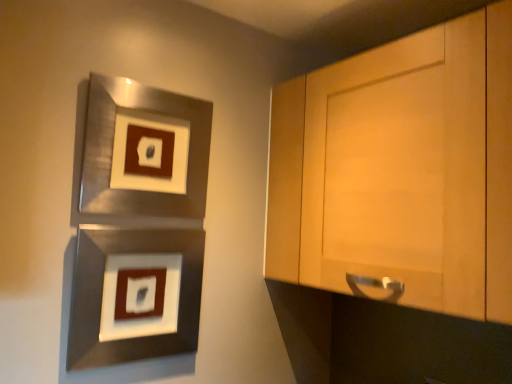
Image resolution: width=512 pixels, height=384 pixels. Describe the element at coordinates (134, 295) in the screenshot. I see `metallic silver picture frame at lower left, arranged as the second picture frame when viewed from the top` at that location.

Locate an element on the screen. This screenshot has width=512, height=384. metallic silver picture frame at lower left, arranged as the second picture frame when viewed from the top is located at coordinates (134, 295).

Image resolution: width=512 pixels, height=384 pixels. Identify the location of metallic silver picture frame at upper left, positioned as the first picture frame in top-to-bottom order. (144, 151).

The width and height of the screenshot is (512, 384). What do you see at coordinates (144, 151) in the screenshot?
I see `metallic silver picture frame at upper left, acting as the second picture frame starting from the bottom` at bounding box center [144, 151].

How much space does metallic silver picture frame at upper left, positioned as the first picture frame in top-to-bottom order, occupy vertically?

metallic silver picture frame at upper left, positioned as the first picture frame in top-to-bottom order, is 40.47 centimeters in height.

The height and width of the screenshot is (384, 512). In order to click on metallic silver picture frame at lower left, arranged as the second picture frame when viewed from the top in this screenshot , I will do `click(134, 295)`.

Between metallic silver picture frame at lower left, arranged as the second picture frame when viewed from the top, and metallic silver picture frame at upper left, acting as the second picture frame starting from the bottom, which one appears on the left side from the viewer's perspective?

From the viewer's perspective, metallic silver picture frame at lower left, arranged as the second picture frame when viewed from the top, appears more on the left side.

Considering their positions, is metallic silver picture frame at lower left, arranged as the 1th picture frame when ordered from the bottom, located in front of or behind metallic silver picture frame at upper left, acting as the second picture frame starting from the bottom?

Visually, metallic silver picture frame at lower left, arranged as the 1th picture frame when ordered from the bottom, is located in front of metallic silver picture frame at upper left, acting as the second picture frame starting from the bottom.

Does point (181, 320) come behind point (93, 187)?

That is True.

From the image's perspective, does metallic silver picture frame at lower left, arranged as the second picture frame when viewed from the top, appear lower than metallic silver picture frame at upper left, positioned as the first picture frame in top-to-bottom order?

Correct, metallic silver picture frame at lower left, arranged as the second picture frame when viewed from the top, appears lower than metallic silver picture frame at upper left, positioned as the first picture frame in top-to-bottom order, in the image.

From a real-world perspective, who is located higher, metallic silver picture frame at lower left, arranged as the 1th picture frame when ordered from the bottom, or metallic silver picture frame at upper left, acting as the second picture frame starting from the bottom?

metallic silver picture frame at upper left, acting as the second picture frame starting from the bottom, from a real-world perspective.

Can you confirm if metallic silver picture frame at lower left, arranged as the 1th picture frame when ordered from the bottom, is wider than metallic silver picture frame at upper left, acting as the second picture frame starting from the bottom?

Correct, the width of metallic silver picture frame at lower left, arranged as the 1th picture frame when ordered from the bottom, exceeds that of metallic silver picture frame at upper left, acting as the second picture frame starting from the bottom.

Which of these two, metallic silver picture frame at lower left, arranged as the second picture frame when viewed from the top, or metallic silver picture frame at upper left, positioned as the first picture frame in top-to-bottom order, stands taller?

Standing taller between the two is metallic silver picture frame at upper left, positioned as the first picture frame in top-to-bottom order.

Can you confirm if metallic silver picture frame at lower left, arranged as the second picture frame when viewed from the top, is bigger than metallic silver picture frame at upper left, positioned as the first picture frame in top-to-bottom order?

Incorrect, metallic silver picture frame at lower left, arranged as the second picture frame when viewed from the top, is not larger than metallic silver picture frame at upper left, positioned as the first picture frame in top-to-bottom order.

Is metallic silver picture frame at upper left, acting as the second picture frame starting from the bottom, located within metallic silver picture frame at lower left, arranged as the second picture frame when viewed from the top?

No, metallic silver picture frame at upper left, acting as the second picture frame starting from the bottom, is located outside of metallic silver picture frame at lower left, arranged as the second picture frame when viewed from the top.

Are metallic silver picture frame at lower left, arranged as the second picture frame when viewed from the top, and metallic silver picture frame at upper left, positioned as the first picture frame in top-to-bottom order, located far from each other?

No, metallic silver picture frame at lower left, arranged as the second picture frame when viewed from the top, is not far from metallic silver picture frame at upper left, positioned as the first picture frame in top-to-bottom order.

Is metallic silver picture frame at lower left, arranged as the 1th picture frame when ordered from the bottom, oriented away from metallic silver picture frame at upper left, acting as the second picture frame starting from the bottom?

No, metallic silver picture frame at upper left, acting as the second picture frame starting from the bottom, is not at the back of metallic silver picture frame at lower left, arranged as the 1th picture frame when ordered from the bottom.

Can you tell me how much metallic silver picture frame at lower left, arranged as the 1th picture frame when ordered from the bottom, and metallic silver picture frame at upper left, positioned as the first picture frame in top-to-bottom order, differ in facing direction?

There is a 0.00199-degree angle between the facing directions of metallic silver picture frame at lower left, arranged as the 1th picture frame when ordered from the bottom, and metallic silver picture frame at upper left, positioned as the first picture frame in top-to-bottom order.

Where is `picture frame on the right of metallic silver picture frame at lower left, arranged as the 1th picture frame when ordered from the bottom`? picture frame on the right of metallic silver picture frame at lower left, arranged as the 1th picture frame when ordered from the bottom is located at coordinates (144, 151).

Considering the positions of objects metallic silver picture frame at upper left, positioned as the first picture frame in top-to-bottom order, and metallic silver picture frame at lower left, arranged as the second picture frame when viewed from the top, in the image provided, who is more to the right, metallic silver picture frame at upper left, positioned as the first picture frame in top-to-bottom order, or metallic silver picture frame at lower left, arranged as the second picture frame when viewed from the top,?

From the viewer's perspective, metallic silver picture frame at upper left, positioned as the first picture frame in top-to-bottom order, appears more on the right side.

From the picture: Which object is more forward, metallic silver picture frame at upper left, acting as the second picture frame starting from the bottom, or metallic silver picture frame at lower left, arranged as the second picture frame when viewed from the top?

metallic silver picture frame at lower left, arranged as the second picture frame when viewed from the top, is in front.

Does point (134, 204) lie in front of point (193, 269)?

Yes.

From the image's perspective, which one is positioned lower, metallic silver picture frame at upper left, acting as the second picture frame starting from the bottom, or metallic silver picture frame at lower left, arranged as the 1th picture frame when ordered from the bottom?

From the image's view, metallic silver picture frame at lower left, arranged as the 1th picture frame when ordered from the bottom, is below.

From a real-world perspective, between metallic silver picture frame at upper left, acting as the second picture frame starting from the bottom, and metallic silver picture frame at lower left, arranged as the 1th picture frame when ordered from the bottom, who is vertically higher?

metallic silver picture frame at upper left, acting as the second picture frame starting from the bottom.

Is metallic silver picture frame at upper left, positioned as the first picture frame in top-to-bottom order, wider or thinner than metallic silver picture frame at lower left, arranged as the second picture frame when viewed from the top?

Considering their sizes, metallic silver picture frame at upper left, positioned as the first picture frame in top-to-bottom order, looks slimmer than metallic silver picture frame at lower left, arranged as the second picture frame when viewed from the top.

Can you confirm if metallic silver picture frame at upper left, positioned as the first picture frame in top-to-bottom order, is shorter than metallic silver picture frame at lower left, arranged as the 1th picture frame when ordered from the bottom?

No.

Can you confirm if metallic silver picture frame at upper left, positioned as the first picture frame in top-to-bottom order, is smaller than metallic silver picture frame at lower left, arranged as the second picture frame when viewed from the top?

No, metallic silver picture frame at upper left, positioned as the first picture frame in top-to-bottom order, is not smaller than metallic silver picture frame at lower left, arranged as the second picture frame when viewed from the top.

Is metallic silver picture frame at upper left, acting as the second picture frame starting from the bottom, located outside metallic silver picture frame at lower left, arranged as the second picture frame when viewed from the top?

metallic silver picture frame at upper left, acting as the second picture frame starting from the bottom, is positioned outside metallic silver picture frame at lower left, arranged as the second picture frame when viewed from the top.

Does metallic silver picture frame at upper left, acting as the second picture frame starting from the bottom, touch metallic silver picture frame at lower left, arranged as the second picture frame when viewed from the top?

No, metallic silver picture frame at upper left, acting as the second picture frame starting from the bottom, is not touching metallic silver picture frame at lower left, arranged as the second picture frame when viewed from the top.

Is metallic silver picture frame at upper left, acting as the second picture frame starting from the bottom, facing away from metallic silver picture frame at lower left, arranged as the 1th picture frame when ordered from the bottom?

No, metallic silver picture frame at upper left, acting as the second picture frame starting from the bottom,'s orientation is not away from metallic silver picture frame at lower left, arranged as the 1th picture frame when ordered from the bottom.

Identify the location of picture frame on the left side of metallic silver picture frame at upper left, positioned as the first picture frame in top-to-bottom order. (134, 295).

In order to click on picture frame located behind the metallic silver picture frame at lower left, arranged as the 1th picture frame when ordered from the bottom in this screenshot , I will do `click(144, 151)`.

Locate an element on the screen. picture frame on the right of metallic silver picture frame at lower left, arranged as the second picture frame when viewed from the top is located at coordinates (144, 151).